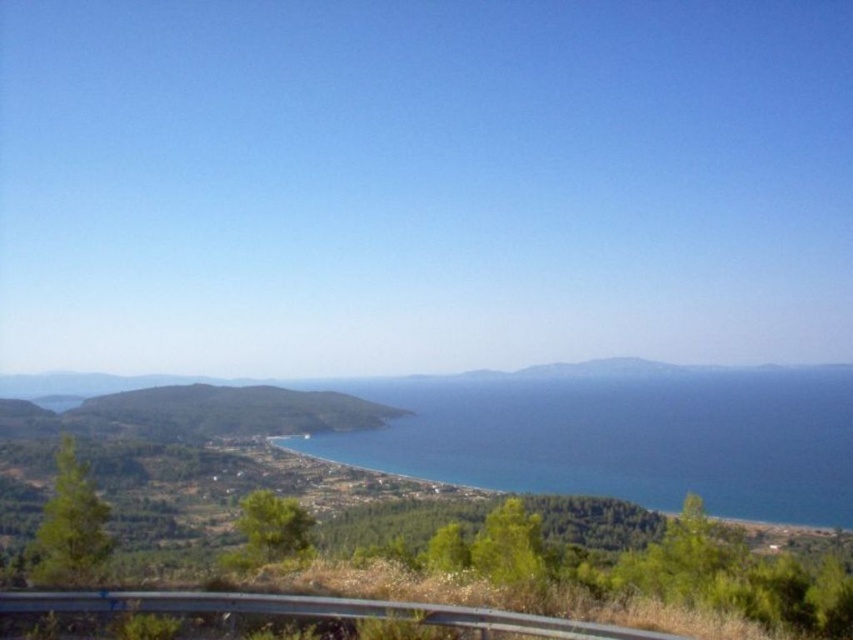
How distant is blue water at center from metallic gray guardrail at lower center?

blue water at center and metallic gray guardrail at lower center are 464.64 meters apart.

Which is more to the left, blue water at center or metallic gray guardrail at lower center?

metallic gray guardrail at lower center is more to the left.

Which is in front, point (397, 467) or point (76, 609)?

Point (76, 609) is in front.

Find the location of a particular element. The height and width of the screenshot is (640, 853). blue water at center is located at coordinates (622, 435).